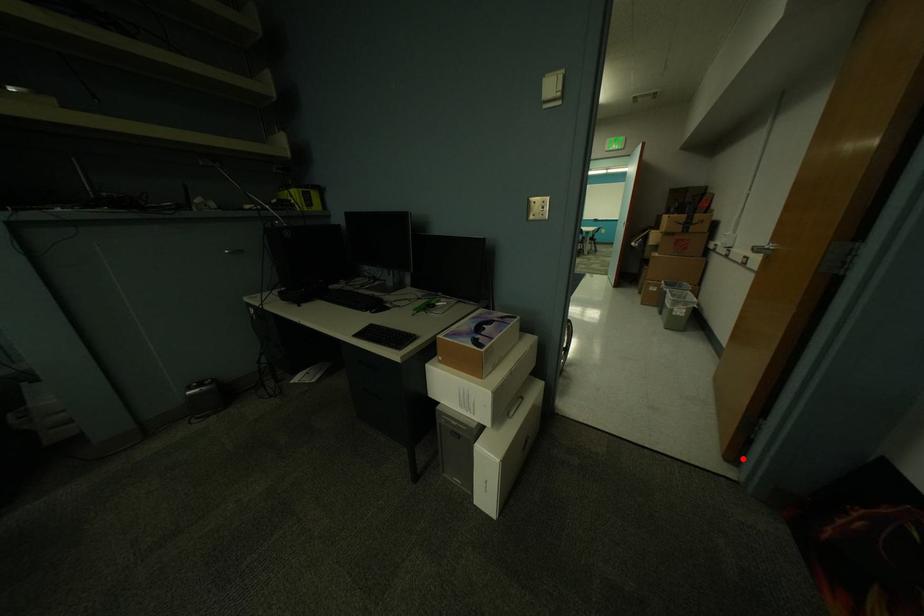
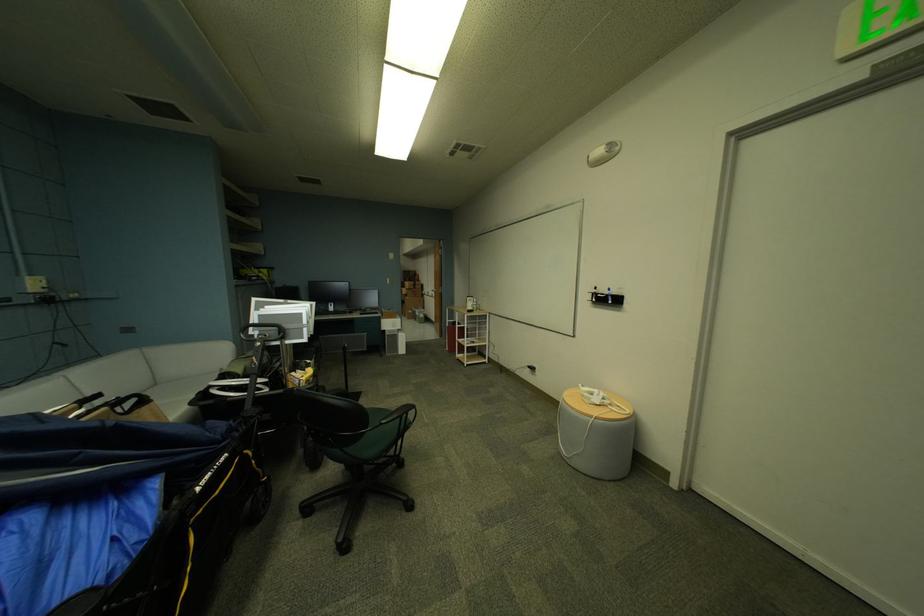
Question: I am providing you with two images of the same scene from different viewpoints. A red point is shown in image1. For the corresponding object point in image2, is it positioned nearer or farther from the camera?

Choices:
 (A) Nearer
 (B) Farther

Answer: (B)